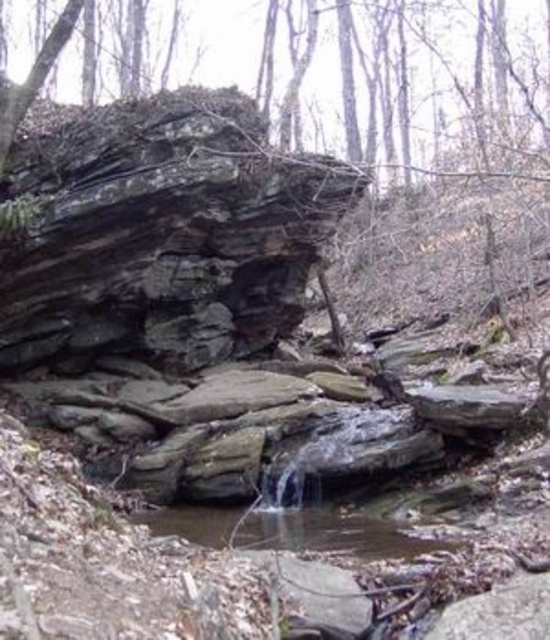
Which is above, rusty stone rock at upper left or clear water stream at center?

rusty stone rock at upper left

Which is in front, point (271, 246) or point (292, 538)?

Point (292, 538)

Is point (85, 154) positioned after point (244, 515)?

Yes, point (85, 154) is farther from viewer.

At what (x,y) coordinates should I click in order to perform the action: click on rusty stone rock at upper left. Please return your answer as a coordinate pair (x, y). Looking at the image, I should click on (162, 230).